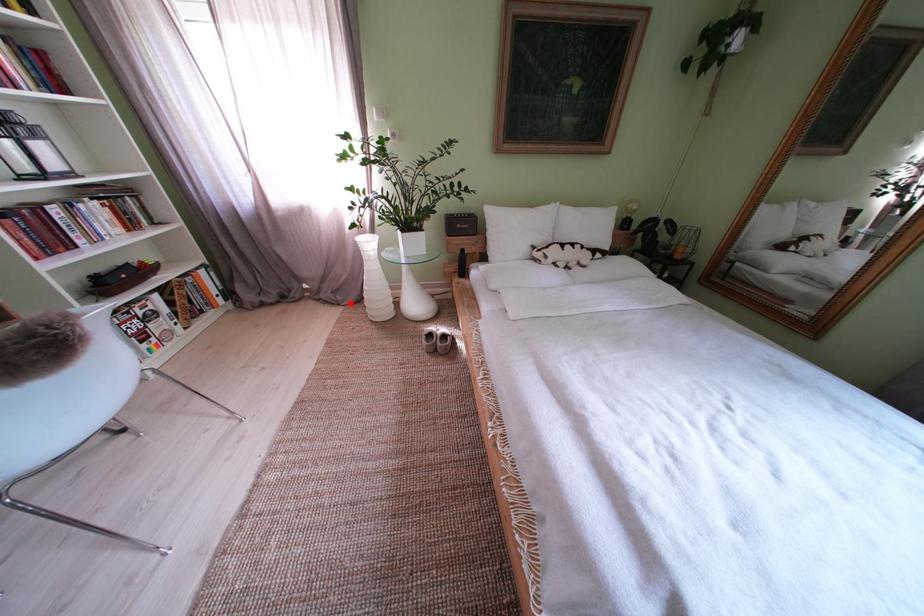
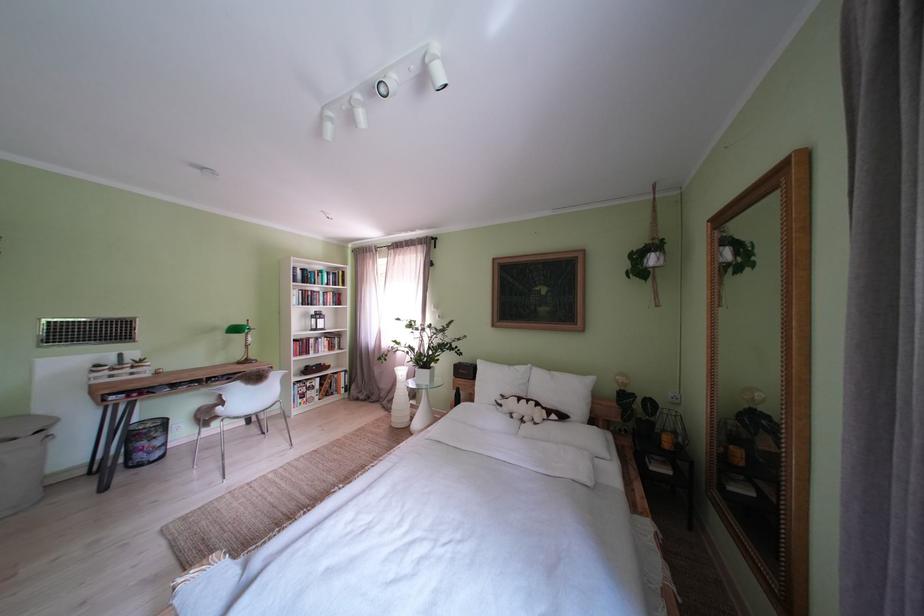
In the second image, find the point that corresponds to the highlighted location in the first image.

(400, 411)